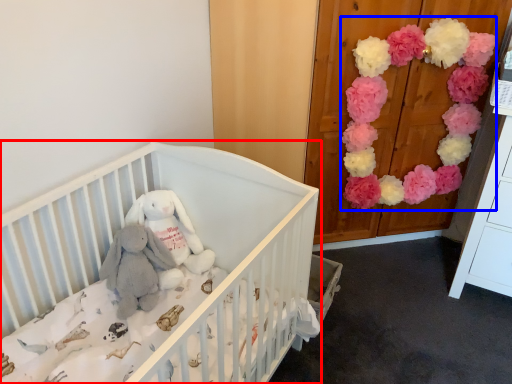
Question: Which of the following is the farthest to the observer, infant bed (highlighted by a red box) or flower (highlighted by a blue box)?

Choices:
 (A) infant bed
 (B) flower

Answer: (B)